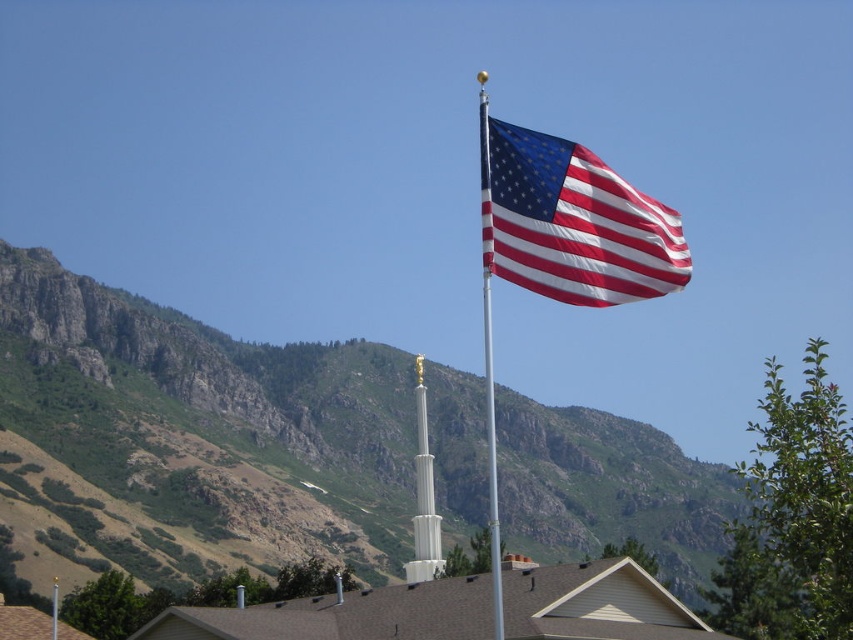
Question: In this image, where is matte fabric flag at upper center located relative to white glossy column at center?

Choices:
 (A) left
 (B) right

Answer: (B)

Question: Based on their relative distances, which object is nearer to the matte fabric flag at upper center?

Choices:
 (A) white glossy column at center
 (B) silver metallic flag pole at upper center

Answer: (A)

Question: Observing the image, what is the correct spatial positioning of green grassy mountain at upper center in reference to matte fabric flag at upper center?

Choices:
 (A) right
 (B) left

Answer: (B)

Question: Considering the real-world distances, which object is closest to the matte fabric flag at upper center?

Choices:
 (A) green grassy mountain at upper center
 (B) white glossy column at center
 (C) silver metallic flag pole at upper center

Answer: (B)

Question: Is matte fabric flag at upper center to the left of silver metallic flag pole at upper center from the viewer's perspective?

Choices:
 (A) no
 (B) yes

Answer: (B)

Question: Which object is the farthest from the matte fabric flag at upper center?

Choices:
 (A) green grassy mountain at upper center
 (B) white glossy column at center

Answer: (A)